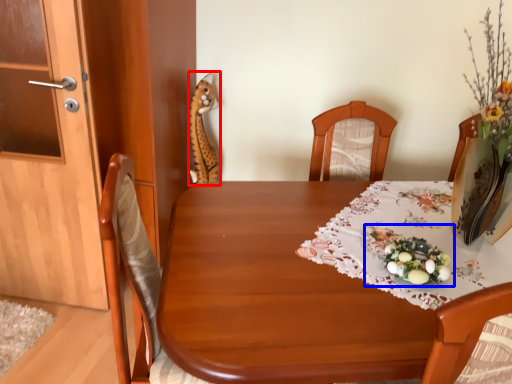
Question: Which of the following is the farthest to the observer, animal (highlighted by a red box) or floral arrangement (highlighted by a blue box)?

Choices:
 (A) animal
 (B) floral arrangement

Answer: (A)